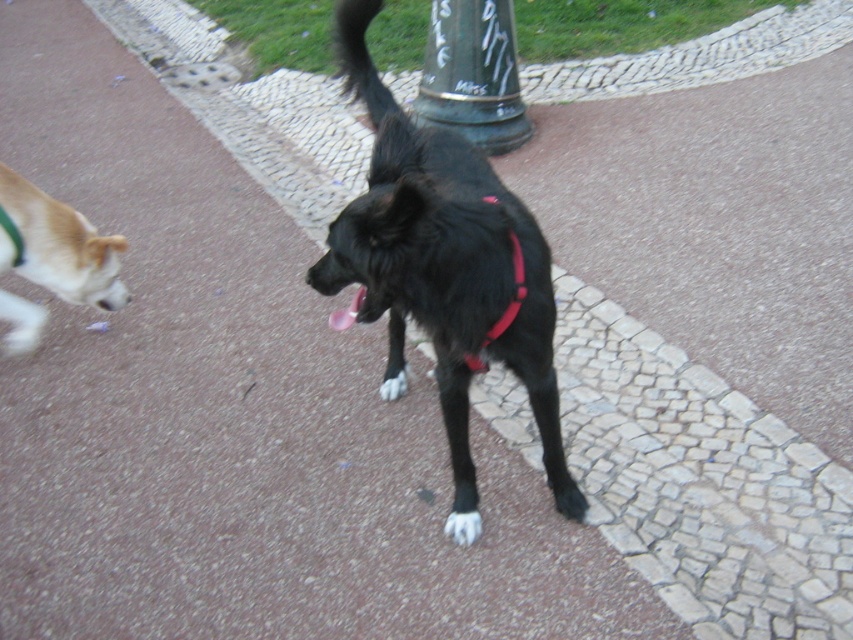
You are a dog owner walking your two dogs on the pathway. You notice the light brown fur at left and the black fur tail at upper center. Which dog is closer to the left side of the pathway?

The light brown fur at left is closer to the left side of the pathway because it is positioned to the left of the black fur tail at upper center.

You are a dog owner trying to decide which dog to call first. The light brown fur at left and the black fur tail at upper center are both in your view. Based on their sizes, which dog should you call first if you want to reach the smaller one?

The black fur tail at upper center is smaller than the light brown fur at left, so you should call the black fur tail at upper center first.

Consider the image. You are a delivery robot with a 1 meter wide package. You need to move along the pathway to reach the lamppost. The black fur dog at center is in your path. Can you go around the dog while staying on the pathway?

The black fur dog at center is positioned at coordinates point (445, 269). Since the pathway is paved and the dog is at a specific point, the robot can navigate around the dog by adjusting its path slightly to the left or right while remaining on the pathway.